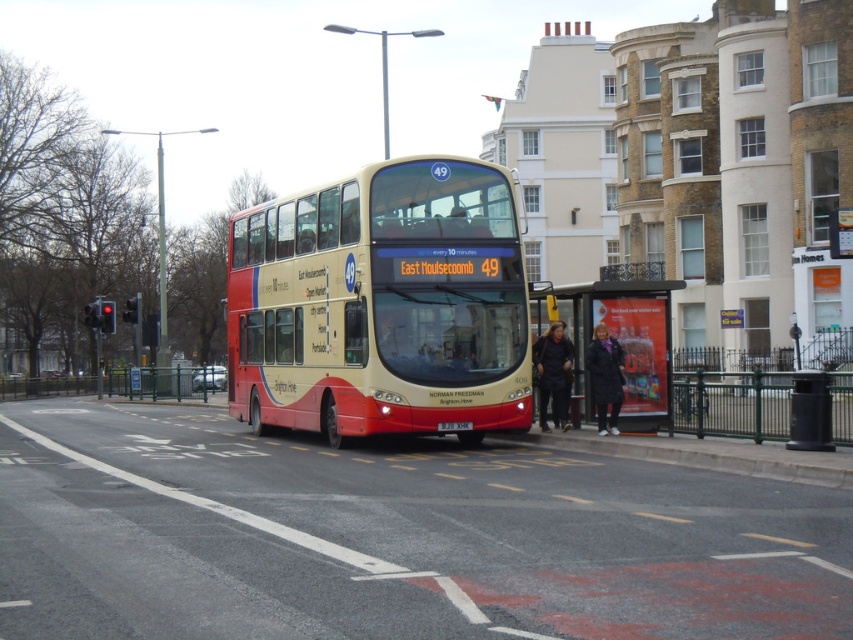
Does beige/red painted double-decker bus at center have a greater height compared to matte plastic bus stop at center?

Yes.

Which is behind, point (389, 317) or point (631, 346)?

Positioned behind is point (631, 346).

Does point (300, 257) lie behind point (625, 289)?

Yes, it is.

Identify the location of beige/red painted double-decker bus at center. This screenshot has width=853, height=640. coord(381,305).

Which is behind, point (576, 388) or point (547, 332)?

The point (576, 388) is behind.

This screenshot has width=853, height=640. I want to click on matte plastic bus stop at center, so click(x=618, y=340).

Between point (314, 321) and point (569, 352), which one is positioned in front?

Point (314, 321) is in front.

Is point (323, 284) behind point (544, 422)?

No, (323, 284) is in front of (544, 422).

Where is `beige/red painted double-decker bus at center`? The image size is (853, 640). beige/red painted double-decker bus at center is located at coordinates (381, 305).